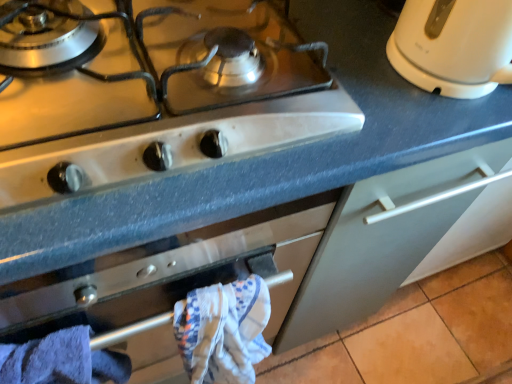
Question: Based on their positions, is white glossy gas stove at upper left located to the left or right of blue cotton bath towel at lower left, placed as the first bath towel when sorted from left to right?

Choices:
 (A) left
 (B) right

Answer: (B)

Question: In the image, is white glossy gas stove at upper left positioned in front of or behind blue cotton bath towel at lower left, which appears as the second bath towel when viewed from the right?

Choices:
 (A) front
 (B) behind

Answer: (A)

Question: Which of these objects is positioned farthest from the white glossy electric kettle at upper right?

Choices:
 (A) white textured bath towel at center, which is the first bath towel in right-to-left order
 (B) blue cotton bath towel at lower left, placed as the first bath towel when sorted from left to right
 (C) white glossy gas stove at upper left

Answer: (B)

Question: Which of these objects is positioned closest to the white glossy gas stove at upper left?

Choices:
 (A) white glossy electric kettle at upper right
 (B) blue cotton bath towel at lower left, which appears as the second bath towel when viewed from the right
 (C) white textured bath towel at center, which is the first bath towel in right-to-left order

Answer: (A)